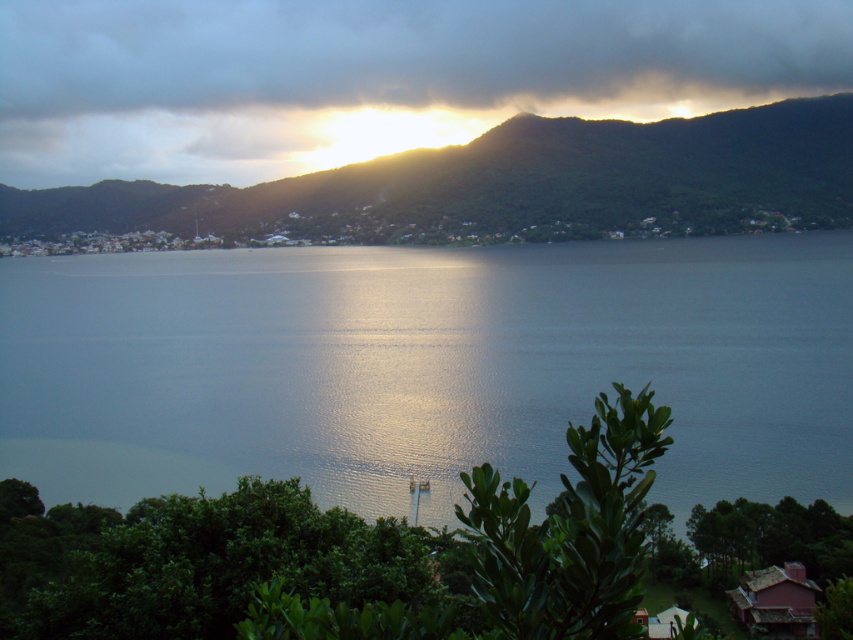
Question: Does cloudy at upper center have a larger size compared to green matte mountain at upper center?

Choices:
 (A) yes
 (B) no

Answer: (B)

Question: Is cloudy at upper center in front of green matte mountain at upper center?

Choices:
 (A) yes
 (B) no

Answer: (B)

Question: Which object is farther from the camera taking this photo?

Choices:
 (A) cloudy at upper center
 (B) green matte mountain at upper center
 (C) glistening water at center

Answer: (A)

Question: Which point is farther to the camera?

Choices:
 (A) cloudy at upper center
 (B) green matte mountain at upper center
 (C) glistening water at center

Answer: (A)

Question: Does cloudy at upper center appear over green matte mountain at upper center?

Choices:
 (A) yes
 (B) no

Answer: (A)

Question: Estimate the real-world distances between objects in this image. Which object is farther from the green matte mountain at upper center?

Choices:
 (A) glistening water at center
 (B) cloudy at upper center

Answer: (A)